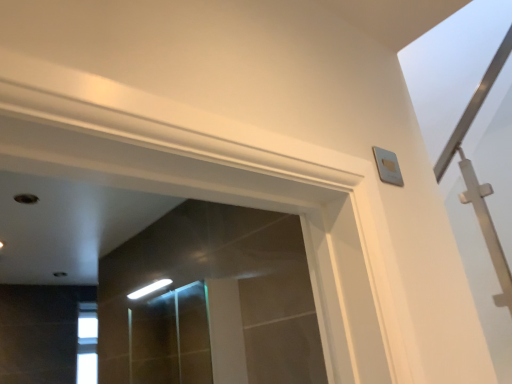
What do you see at coordinates (170, 338) in the screenshot?
I see `clear glass screen door at center` at bounding box center [170, 338].

Find the location of a particular element. The width and height of the screenshot is (512, 384). clear glass screen door at center is located at coordinates (170, 338).

In order to face clear glass screen door at center, should I rotate leftwards or rightwards?

Rotate your view left by about 12.065°.

Where is `clear glass screen door at center`? clear glass screen door at center is located at coordinates (170, 338).